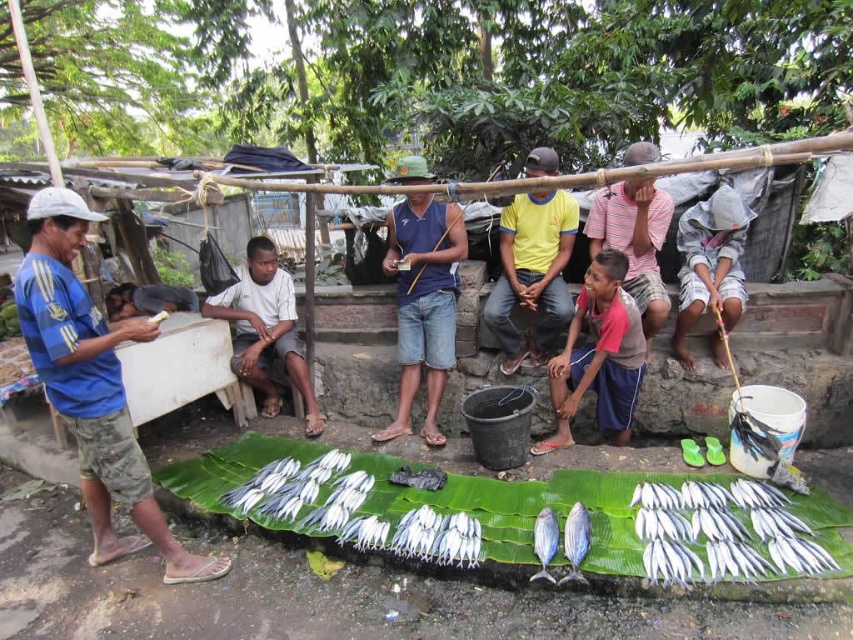
You are a customer at the market and want to buy the silver shiny fish at lower center. The vendor says the fish is wider than your yellow cotton shirt at center. Is this true?

Yes, the silver shiny fish at lower center is wider than the yellow cotton shirt at center according to the vendor.

You are a customer at the market and want to buy the silver shiny fish at lower center. Which direction should you move relative to the blue striped shirt at left to reach the fish?

The blue striped shirt at left is positioned on the left side of the silver shiny fish at lower center, so you should move to the right relative to the blue striped shirt at left to reach the fish.